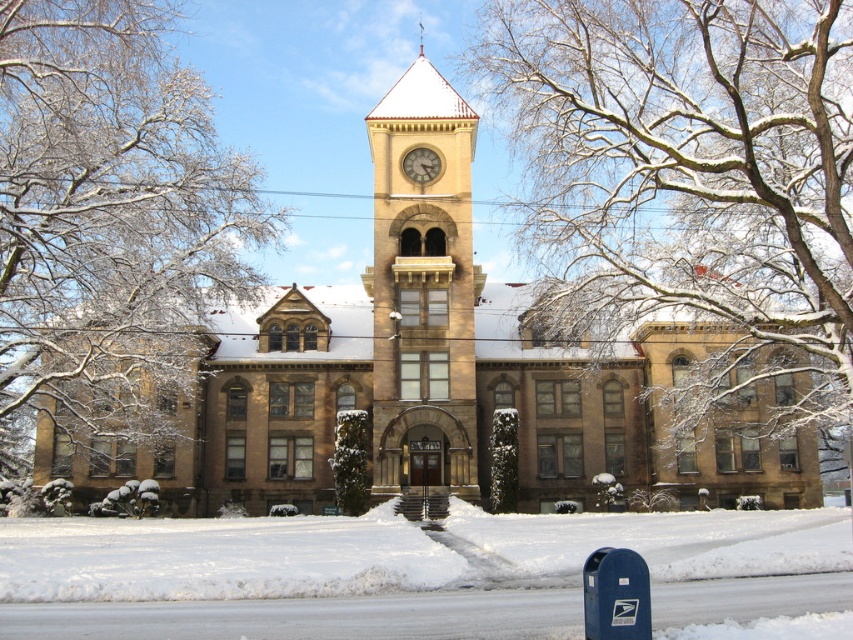
You are a tourist visiting the historic building and want to take a photo that includes both the brown stone church at center and the matte brown clock at center. Which object should you position closer to the camera to ensure both are in the frame?

Since the brown stone church at center is larger than the matte brown clock at center, you should position the matte brown clock at center closer to the camera to balance their sizes in the photo.

In the scene shown: You are standing at the entrance of the historic building and see two points marked in the image. Which point, point (837,45) or point (44,64), is closer to you?

Point (837,45) is in front of point (44,64), so it is closer to you.